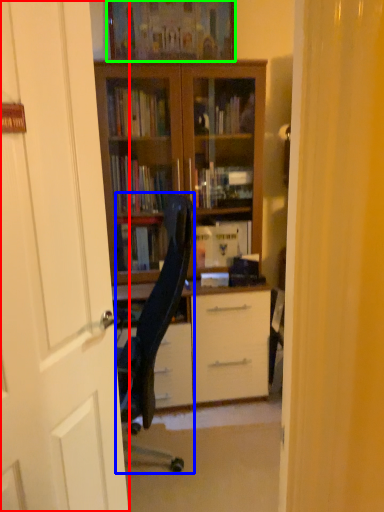
Question: Estimate the real-world distances between objects in this image. Which object is farther from door (highlighted by a red box), chair (highlighted by a blue box) or picture frame (highlighted by a green box)?

Choices:
 (A) chair
 (B) picture frame

Answer: (B)